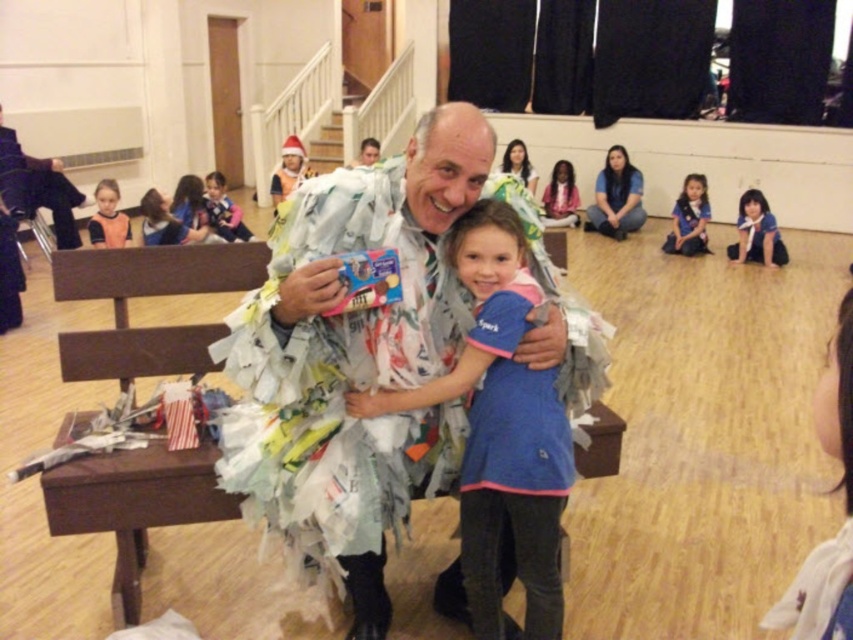
Is point (36, 161) closer to viewer compared to point (741, 252)?

Yes, it is in front of point (741, 252).

Looking at this image, is matte black jacket at upper left wider than blue fabric at lower right?

Correct, the width of matte black jacket at upper left exceeds that of blue fabric at lower right.

Between point (0, 154) and point (737, 250), which one is positioned behind?

Positioned behind is point (737, 250).

Identify the location of matte black jacket at upper left. This screenshot has height=640, width=853. (38, 188).

Who is positioned more to the left, white paper costume at center or light brown hair at upper left?

From the viewer's perspective, light brown hair at upper left appears more on the left side.

Find the location of a particular element. Image resolution: width=853 pixels, height=640 pixels. white paper costume at center is located at coordinates (352, 358).

Is point (404, 385) closer to viewer compared to point (111, 200)?

Yes, point (404, 385) is in front of point (111, 200).

This screenshot has width=853, height=640. In order to click on white paper costume at center in this screenshot , I will do `click(352, 358)`.

Can you confirm if white paper costume at center is thinner than matte black jacket at upper left?

No, white paper costume at center is not thinner than matte black jacket at upper left.

Is white paper costume at center to the left of matte black jacket at upper left from the viewer's perspective?

No, white paper costume at center is not to the left of matte black jacket at upper left.

Is point (395, 468) closer to viewer compared to point (36, 184)?

Yes, point (395, 468) is closer to viewer.

What are the coordinates of `white paper costume at center` in the screenshot? It's located at (352, 358).